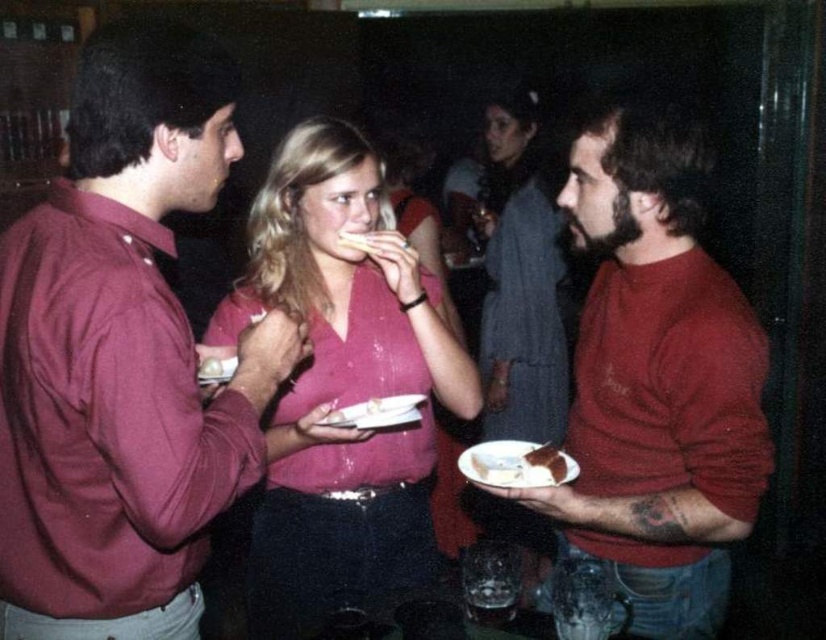
Is white paper plate at lower right positioned behind chocolate cake at right?

No, it is not.

Who is more distant from viewer, [549,476] or [553,464]?

Point [553,464]

Is point (471, 480) positioned before point (553, 460)?

Yes, it is in front of point (553, 460).

What are the coordinates of `white paper plate at lower right` in the screenshot? It's located at (511, 465).

Who is shorter, pink satin blouse at center or chocolate cake at right?

chocolate cake at right

Does point (340, 484) lie behind point (558, 449)?

No, it is in front of (558, 449).

Is point (413, 324) closer to camera compared to point (535, 452)?

That is False.

You are a GUI agent. You are given a task and a screenshot of the screen. Output one action in this format:
    pyautogui.click(x=<x>, y=<y>)
    Task: Click on the pink satin blouse at center
    The height and width of the screenshot is (640, 826).
    Given the screenshot: What is the action you would take?
    pyautogui.click(x=340, y=385)

Does point (496, 353) lie behind point (489, 464)?

Yes.

This screenshot has width=826, height=640. What are the coordinates of `matte pink blouse at center` in the screenshot? It's located at (520, 276).